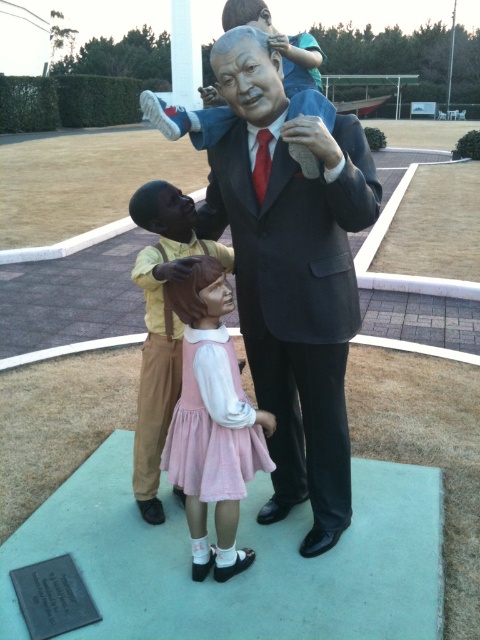
Can you confirm if pink fabric dress at center is bigger than matte black statue at center?

Incorrect, pink fabric dress at center is not larger than matte black statue at center.

Identify the location of pink fabric dress at center. The image size is (480, 640). (213, 422).

Does point (187, 408) come in front of point (159, 193)?

Yes, point (187, 408) is closer to viewer.

In order to click on pink fabric dress at center in this screenshot , I will do (x=213, y=422).

How far apart are matte black suit at center and pink fabric dress at center?

They are 14.66 inches apart.

Who is more forward, (320, 374) or (224, 394)?

Point (224, 394)

The height and width of the screenshot is (640, 480). Identify the location of matte black suit at center. (291, 275).

Can you confirm if matte black suit at center is positioned to the left of matte black statue at center?

No, matte black suit at center is not to the left of matte black statue at center.

Which of these two, matte black suit at center or matte black statue at center, stands shorter?

matte black statue at center

Who is more forward, (336, 312) or (142, 477)?

Point (336, 312)

Find the location of `matte black suit at center`. matte black suit at center is located at coordinates (291, 275).